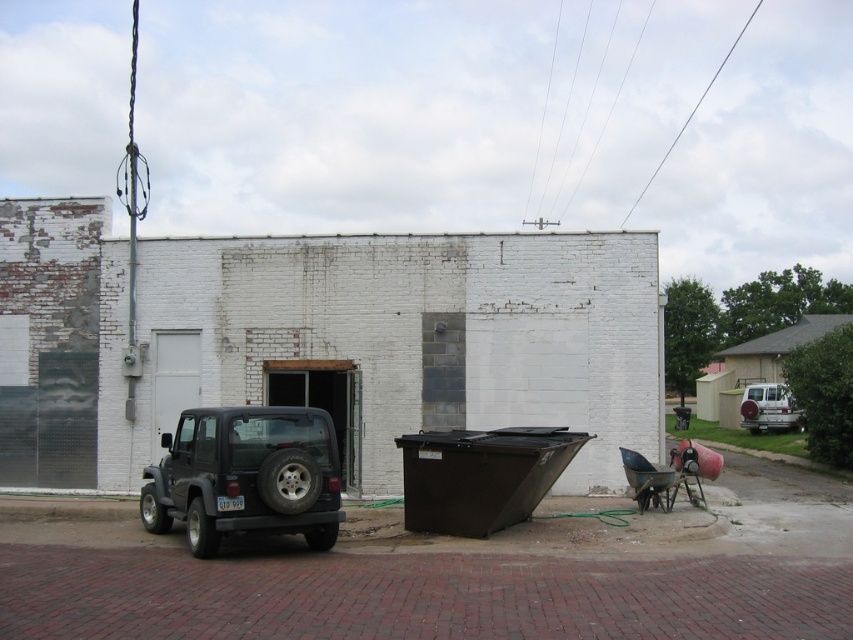
Based on the photo, you are a delivery person trying to park your 6.5 feet tall delivery van between the matte black suv at left and the silver metallic suv at right. Can you fit your van between them based on their heights?

The matte black suv at left is much taller as silver metallic suv at right. Since your delivery van is 6.5 feet tall, you can fit it between them as long as the space between the two SUVs is sufficient in height. However, the exact height clearance isnanot provided, so you should measure the available space before proceeding.

You are a delivery person trying to park your van between the two suvs. The van is 18 feet long. Can you fit it between the matte black suv at left and the silver metallic suv at right?

The matte black suv at left is bigger than the silver metallic suv at right, but the exact distance between them isn

You are a delivery driver who needs to park your truck between the matte black suv at left and the silver metallic suv at right. Your truck is 2.5 meters wide. Can you fit your truck between them?

The matte black suv at left is wider than the silver metallic suv at right, so the space between them may not be sufficient for a 2.5 meter wide truck. You should check the exact distance before attempting to park.